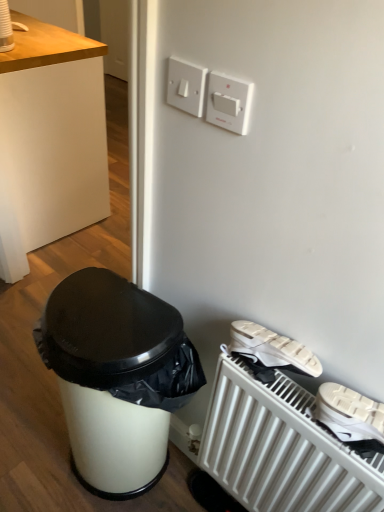
Question: Is white plastic switch at upper center completely or partially outside of white matte radiator at lower right?

Choices:
 (A) yes
 (B) no

Answer: (A)

Question: Is white plastic switch at upper center oriented towards white matte radiator at lower right?

Choices:
 (A) yes
 (B) no

Answer: (B)

Question: Considering the relative sizes of white plastic switch at upper center and white matte radiator at lower right in the image provided, is white plastic switch at upper center shorter than white matte radiator at lower right?

Choices:
 (A) yes
 (B) no

Answer: (A)

Question: From a real-world perspective, is white plastic switch at upper center physically below white matte radiator at lower right?

Choices:
 (A) yes
 (B) no

Answer: (B)

Question: Is the position of white plastic switch at upper center less distant than that of white matte radiator at lower right?

Choices:
 (A) no
 (B) yes

Answer: (A)

Question: Is white glossy trash can at lower left wider or thinner than white plastic light switch at upper center?

Choices:
 (A) wide
 (B) thin

Answer: (A)

Question: Would you say white glossy trash can at lower left is inside or outside white plastic light switch at upper center?

Choices:
 (A) inside
 (B) outside

Answer: (B)

Question: Is point (87, 466) closer or farther from the camera than point (215, 119)?

Choices:
 (A) farther
 (B) closer

Answer: (A)

Question: From a real-world perspective, relative to white plastic light switch at upper center, is white glossy trash can at lower left vertically above or below?

Choices:
 (A) below
 (B) above

Answer: (A)

Question: From a real-world perspective, is white plastic light switch at upper center positioned above or below white glossy trash can at lower left?

Choices:
 (A) above
 (B) below

Answer: (A)

Question: Is white plastic light switch at upper center situated inside white glossy trash can at lower left or outside?

Choices:
 (A) inside
 (B) outside

Answer: (B)

Question: Would you say white plastic light switch at upper center is to the left or to the right of white glossy trash can at lower left in the picture?

Choices:
 (A) left
 (B) right

Answer: (B)

Question: Considering the positions of white plastic light switch at upper center and white glossy trash can at lower left in the image, is white plastic light switch at upper center bigger or smaller than white glossy trash can at lower left?

Choices:
 (A) big
 (B) small

Answer: (B)

Question: Would you say white wood desk at upper left is inside or outside white plastic light switch at upper center?

Choices:
 (A) outside
 (B) inside

Answer: (A)

Question: From the image's perspective, is white wood desk at upper left positioned above or below white plastic light switch at upper center?

Choices:
 (A) above
 (B) below

Answer: (A)